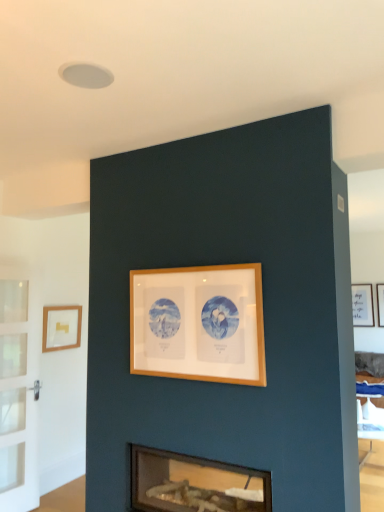
The height and width of the screenshot is (512, 384). I want to click on matte gold picture frame at left, which ranks as the third picture frame in right-to-left order, so click(x=61, y=327).

Identify the location of matte glass fireplace at lower center. (194, 484).

Measure the distance between matte glass fireplace at lower center and camera.

matte glass fireplace at lower center and camera are 7.20 feet apart from each other.

What are the coordinates of `white matte picture frame at upper right, marked as the 3th picture frame in a front-to-back arrangement` in the screenshot? It's located at (362, 305).

At what (x,y) coordinates should I click in order to perform the action: click on matte gold picture frame at left, which appears as the 2th picture frame when viewed from the back. Please return your answer as a coordinate pair (x, y). This screenshot has width=384, height=512. Looking at the image, I should click on (61, 327).

Can we say white matte picture frame at upper right, marked as the 3th picture frame in a front-to-back arrangement, lies outside wooden frame at center, marked as the first picture frame in a front-to-back arrangement?

Yes, white matte picture frame at upper right, marked as the 3th picture frame in a front-to-back arrangement, is outside of wooden frame at center, marked as the first picture frame in a front-to-back arrangement.

Which of these two, white matte picture frame at upper right, acting as the 1th picture frame starting from the right, or wooden frame at center, marked as the 2th picture frame in a left-to-right arrangement, is thinner?

Thinner between the two is wooden frame at center, marked as the 2th picture frame in a left-to-right arrangement.

From a real-world perspective, starting from the wooden frame at center, marked as the 2th picture frame in a left-to-right arrangement, which picture frame is the 1st one below it? Please provide its 2D coordinates.

[(362, 305)]

Is white matte picture frame at upper right, acting as the 1th picture frame starting from the right, looking in the opposite direction of wooden frame at center, marked as the 2th picture frame in a left-to-right arrangement?

white matte picture frame at upper right, acting as the 1th picture frame starting from the right, does not have its back to wooden frame at center, marked as the 2th picture frame in a left-to-right arrangement.

Considering the relative positions of white matte picture frame at upper right, which is counted as the 3th picture frame, starting from the left, and matte glass fireplace at lower center in the image provided, is white matte picture frame at upper right, which is counted as the 3th picture frame, starting from the left, to the left or to the right of matte glass fireplace at lower center?

From the image, it's evident that white matte picture frame at upper right, which is counted as the 3th picture frame, starting from the left, is to the right of matte glass fireplace at lower center.

From a real-world perspective, relative to matte glass fireplace at lower center, is white matte picture frame at upper right, acting as the 1th picture frame starting from the right, vertically above or below?

From a real-world perspective, white matte picture frame at upper right, acting as the 1th picture frame starting from the right, is physically above matte glass fireplace at lower center.

Could you tell me if white matte picture frame at upper right, which is counted as the 3th picture frame, starting from the left, is facing matte glass fireplace at lower center?

Yes.

Which object is thinner, white matte picture frame at upper right, which is counted as the 3th picture frame, starting from the left, or matte glass fireplace at lower center?

With smaller width is white matte picture frame at upper right, which is counted as the 3th picture frame, starting from the left.

Does point (75, 318) come closer to viewer compared to point (10, 466)?

No, (75, 318) is further to viewer.

Considering the sizes of objects matte gold picture frame at left, which is the 1th picture frame from left to right, and clear glass door at left in the image provided, who is wider, matte gold picture frame at left, which is the 1th picture frame from left to right, or clear glass door at left?

matte gold picture frame at left, which is the 1th picture frame from left to right, is wider.

Between matte gold picture frame at left, the second picture frame from the front, and clear glass door at left, which one is positioned behind?

matte gold picture frame at left, the second picture frame from the front, is further from the camera.

Does matte gold picture frame at left, which is the 1th picture frame from left to right, touch clear glass door at left?

No, matte gold picture frame at left, which is the 1th picture frame from left to right, is not making contact with clear glass door at left.

From a real-world perspective, between matte gold picture frame at left, which appears as the 2th picture frame when viewed from the back, and wooden frame at center, the 2th picture frame viewed from the right, who is vertically higher?

In real-world perspective, wooden frame at center, the 2th picture frame viewed from the right, is above.

Is matte gold picture frame at left, which appears as the 2th picture frame when viewed from the back, facing towards wooden frame at center, which ranks as the third picture frame in back-to-front order?

Yes, matte gold picture frame at left, which appears as the 2th picture frame when viewed from the back, is aimed at wooden frame at center, which ranks as the third picture frame in back-to-front order.

The width and height of the screenshot is (384, 512). I want to click on picture frame that is the 1st one when counting downward from the wooden frame at center, which ranks as the third picture frame in back-to-front order (from the image's perspective), so click(61, 327).

How many degrees apart are the facing directions of matte gold picture frame at left, which is the 1th picture frame from left to right, and wooden frame at center, marked as the first picture frame in a front-to-back arrangement?

The facing directions of matte gold picture frame at left, which is the 1th picture frame from left to right, and wooden frame at center, marked as the first picture frame in a front-to-back arrangement, are 90.4 degrees apart.

From the image's perspective, is clear glass door at left on top of matte glass fireplace at lower center?

Yes, from the image's perspective, clear glass door at left is on top of matte glass fireplace at lower center.

Can you see clear glass door at left touching matte glass fireplace at lower center?

No, clear glass door at left is not beside matte glass fireplace at lower center.

Is clear glass door at left wider or thinner than matte glass fireplace at lower center?

clear glass door at left is thinner than matte glass fireplace at lower center.

Considering the sizes of objects clear glass door at left and matte glass fireplace at lower center in the image provided, who is shorter, clear glass door at left or matte glass fireplace at lower center?

Standing shorter between the two is matte glass fireplace at lower center.

Can you confirm if wooden frame at center, marked as the 2th picture frame in a left-to-right arrangement, is smaller than white matte picture frame at upper right, which is counted as the 3th picture frame, starting from the left?

No.

Based on the photo, what's the angular difference between wooden frame at center, marked as the 2th picture frame in a left-to-right arrangement, and white matte picture frame at upper right, which is counted as the 3th picture frame, starting from the left,'s facing directions?

The angular difference between wooden frame at center, marked as the 2th picture frame in a left-to-right arrangement, and white matte picture frame at upper right, which is counted as the 3th picture frame, starting from the left, is 1.38 degrees.

Does point (253, 344) appear closer or farther from the camera than point (369, 323)?

Clearly, point (253, 344) is closer to the camera than point (369, 323).

From the image's perspective, which one is positioned lower, wooden frame at center, which ranks as the third picture frame in back-to-front order, or white matte picture frame at upper right, the 1th picture frame when ordered from back to front?

white matte picture frame at upper right, the 1th picture frame when ordered from back to front.

I want to click on glass door on the left of the white matte picture frame at upper right, which is counted as the 3th picture frame, starting from the left, so click(17, 399).

Are clear glass door at left and white matte picture frame at upper right, the 1th picture frame when ordered from back to front, making contact?

No, clear glass door at left is not touching white matte picture frame at upper right, the 1th picture frame when ordered from back to front.

From a real-world perspective, is clear glass door at left physically located above or below white matte picture frame at upper right, which is counted as the 3th picture frame, starting from the left?

From a real-world perspective, clear glass door at left is physically below white matte picture frame at upper right, which is counted as the 3th picture frame, starting from the left.

Which is more to the right, clear glass door at left or white matte picture frame at upper right, acting as the 1th picture frame starting from the right?

From the viewer's perspective, white matte picture frame at upper right, acting as the 1th picture frame starting from the right, appears more on the right side.

I want to click on picture frame that is the 2nd one when counting upward from the white matte picture frame at upper right, the 1th picture frame when ordered from back to front (from the image's perspective), so click(x=198, y=323).

Where is `fireplace below the white matte picture frame at upper right, which is counted as the 3th picture frame, starting from the left (from the image's perspective)`? This screenshot has width=384, height=512. fireplace below the white matte picture frame at upper right, which is counted as the 3th picture frame, starting from the left (from the image's perspective) is located at coordinates (194, 484).

From the image, which object appears to be farther from wooden frame at center, marked as the first picture frame in a front-to-back arrangement, clear glass door at left or matte glass fireplace at lower center?

clear glass door at left is further to wooden frame at center, marked as the first picture frame in a front-to-back arrangement.

Looking at the image, which one is located further to clear glass door at left, white matte picture frame at upper right, acting as the 1th picture frame starting from the right, or matte gold picture frame at left, which ranks as the third picture frame in right-to-left order?

white matte picture frame at upper right, acting as the 1th picture frame starting from the right, is positioned further to the anchor clear glass door at left.

When comparing their distances from wooden frame at center, marked as the first picture frame in a front-to-back arrangement, does matte glass fireplace at lower center or white matte picture frame at upper right, which is counted as the 3th picture frame, starting from the left, seem further?

white matte picture frame at upper right, which is counted as the 3th picture frame, starting from the left.

Looking at the image, which one is located closer to white matte picture frame at upper right, acting as the 1th picture frame starting from the right, clear glass door at left or matte glass fireplace at lower center?

matte glass fireplace at lower center.

Which object lies further to the anchor point clear glass door at left, wooden frame at center, the 2th picture frame viewed from the right, or white matte picture frame at upper right, which is counted as the 3th picture frame, starting from the left?

white matte picture frame at upper right, which is counted as the 3th picture frame, starting from the left, is further to clear glass door at left.

Looking at this image, considering their positions, is white matte picture frame at upper right, marked as the 3th picture frame in a front-to-back arrangement, positioned closer to clear glass door at left than wooden frame at center, marked as the first picture frame in a front-to-back arrangement?

Answer: wooden frame at center, marked as the first picture frame in a front-to-back arrangement, is positioned closer to the anchor clear glass door at left.

When comparing their distances from matte glass fireplace at lower center, does wooden frame at center, the 2th picture frame viewed from the right, or matte gold picture frame at left, which ranks as the third picture frame in right-to-left order, seem closer?

wooden frame at center, the 2th picture frame viewed from the right, is positioned closer to the anchor matte glass fireplace at lower center.

When comparing their distances from wooden frame at center, marked as the 2th picture frame in a left-to-right arrangement, does matte glass fireplace at lower center or matte gold picture frame at left, which ranks as the third picture frame in right-to-left order, seem further?

matte gold picture frame at left, which ranks as the third picture frame in right-to-left order, is further to wooden frame at center, marked as the 2th picture frame in a left-to-right arrangement.

This screenshot has width=384, height=512. Identify the location of picture frame between wooden frame at center, which ranks as the third picture frame in back-to-front order, and white matte picture frame at upper right, acting as the 1th picture frame starting from the right, along the z-axis. (61, 327).

The image size is (384, 512). In order to click on glass door between matte glass fireplace at lower center and matte gold picture frame at left, the second picture frame from the front, in the front-back direction in this screenshot , I will do `click(17, 399)`.

Where is `glass door between matte glass fireplace at lower center and white matte picture frame at upper right, the 1th picture frame when ordered from back to front, in the front-back direction`? Image resolution: width=384 pixels, height=512 pixels. glass door between matte glass fireplace at lower center and white matte picture frame at upper right, the 1th picture frame when ordered from back to front, in the front-back direction is located at coordinates (17, 399).

Locate an element on the screen. This screenshot has height=512, width=384. glass door positioned between wooden frame at center, marked as the first picture frame in a front-to-back arrangement, and matte gold picture frame at left, which is the 1th picture frame from left to right, from near to far is located at coordinates (17, 399).